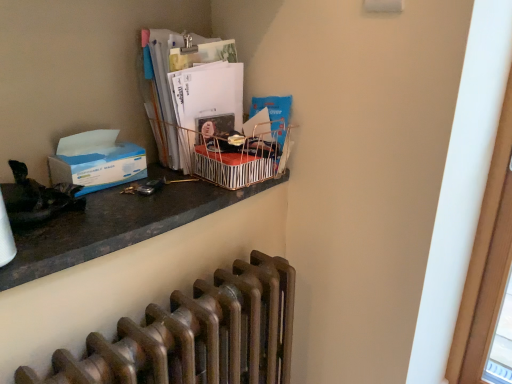
This screenshot has width=512, height=384. Identify the location of vacant area that is in front of blue paper at left. (113, 205).